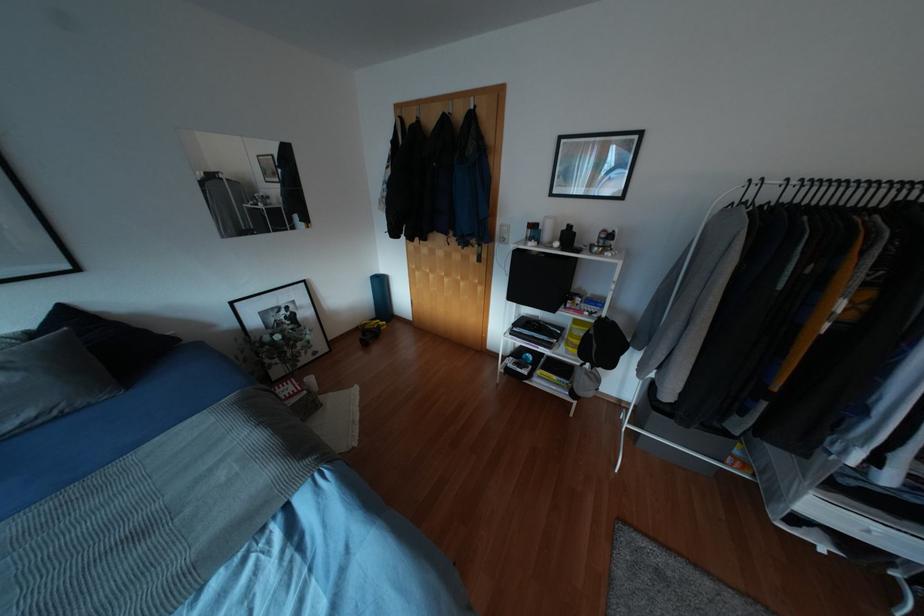
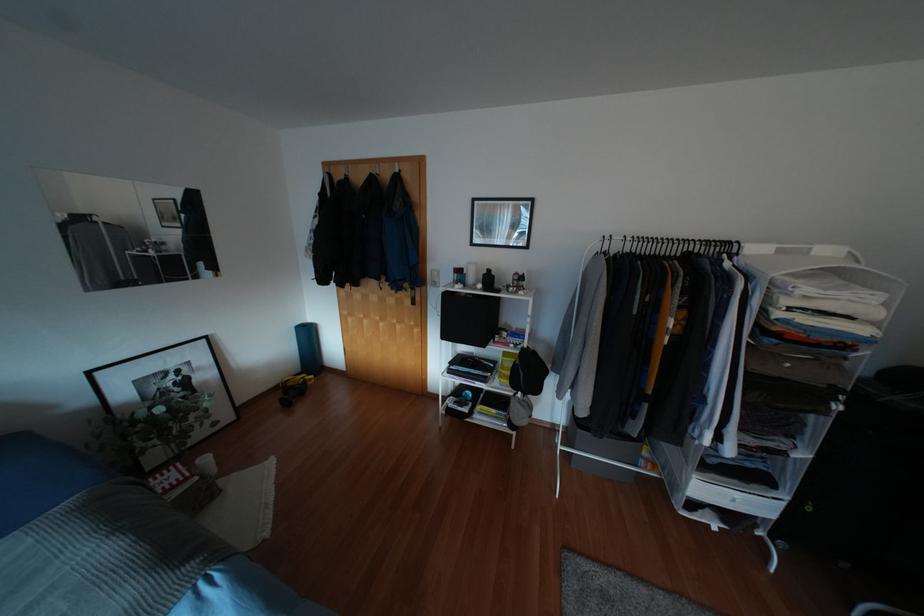
In the second image, find the point that corresponds to point 381,328 in the first image.

(309, 383)